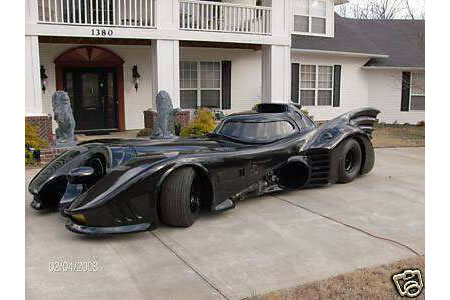
Where is `middle column`? The height and width of the screenshot is (300, 450). middle column is located at coordinates click(170, 68).